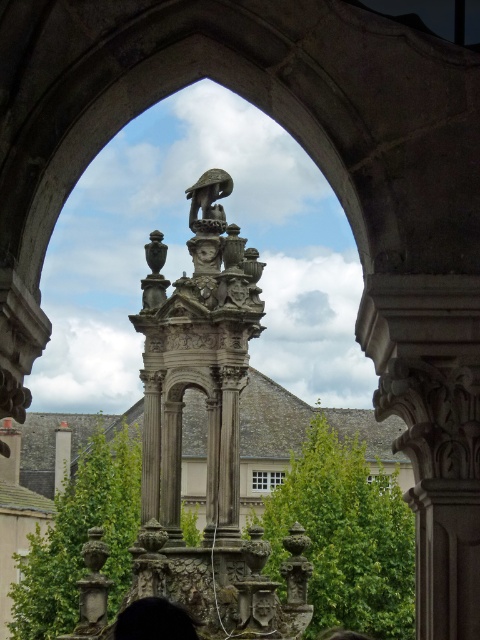
You are standing in front of the ornate stone archway and want to take a photo of both the shiny bronze bird at center and the white marble pillar at center. Which object should you position to the left side of your camera frame to include both in the shot?

You should position the white marble pillar at center to the left side of your camera frame because the shiny bronze bird at center is to the right of it, ensuring both are included in the shot.

You are standing in front of the archway and notice a point marked at coordinates (154,620). What object is located at this point?

The point at coordinates (154,620) marks the black hair at lower center.

You are a tourist standing in front of the ornate stone archway and looking at the scene. You notice two elements in the image. One is the black hair at lower center and the other is the shiny bronze bird at center. Which one is positioned to the left of the other?

The black hair at lower center is to the left of the shiny bronze bird at center.